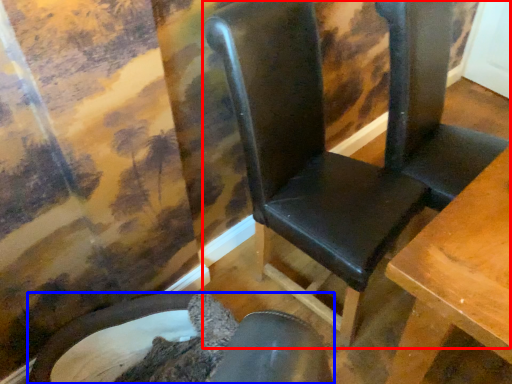
Question: Which object appears closest to the camera in this image, chair (highlighted by a red box) or chair (highlighted by a blue box)?

Choices:
 (A) chair
 (B) chair

Answer: (A)